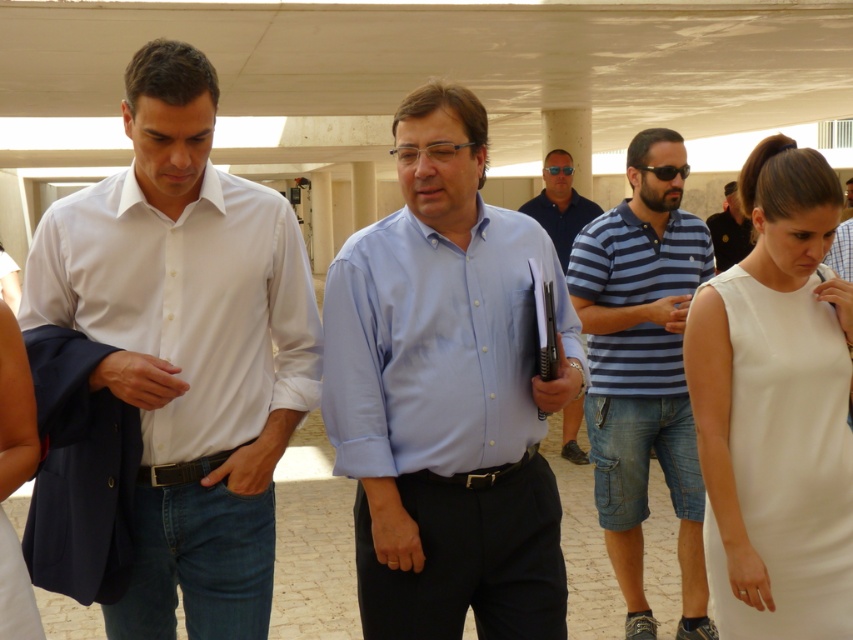
Question: Which is farther from the light blue button-down shirt at center?

Choices:
 (A) black shirt at center
 (B) white satin dress at right

Answer: (A)

Question: Is white smooth shirt at left positioned before blue striped polo shirt at right?

Choices:
 (A) no
 (B) yes

Answer: (B)

Question: Which of the following is the closest to the observer?

Choices:
 (A) (363, 540)
 (B) (833, 240)

Answer: (A)

Question: Is white satin dress at lower left wider than blue shirt at center?

Choices:
 (A) no
 (B) yes

Answer: (A)

Question: Is light blue button-down shirt at center thinner than white smooth shirt at left?

Choices:
 (A) yes
 (B) no

Answer: (A)

Question: Which object is closer to the camera taking this photo?

Choices:
 (A) white matte dress at right
 (B) white smooth shirt at left
 (C) blue striped polo shirt at right
 (D) white satin dress at right

Answer: (B)